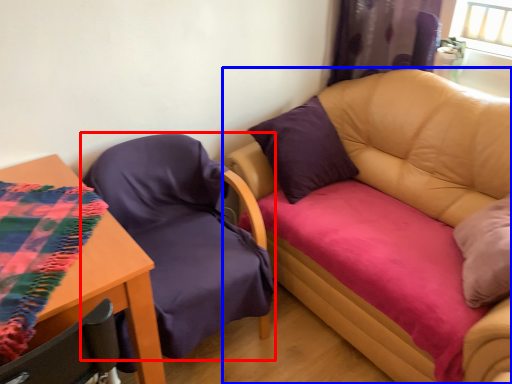
Question: Which point is closer to the camera, chair (highlighted by a red box) or studio couch (highlighted by a blue box)?

Choices:
 (A) chair
 (B) studio couch

Answer: (B)